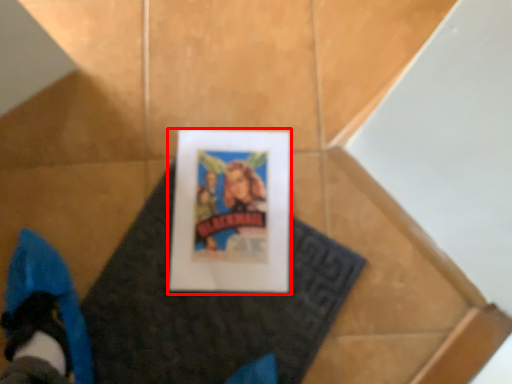
Question: From the image's perspective, where is picture frame (annotated by the red box) located in relation to blanket in the image?

Choices:
 (A) below
 (B) above

Answer: (B)